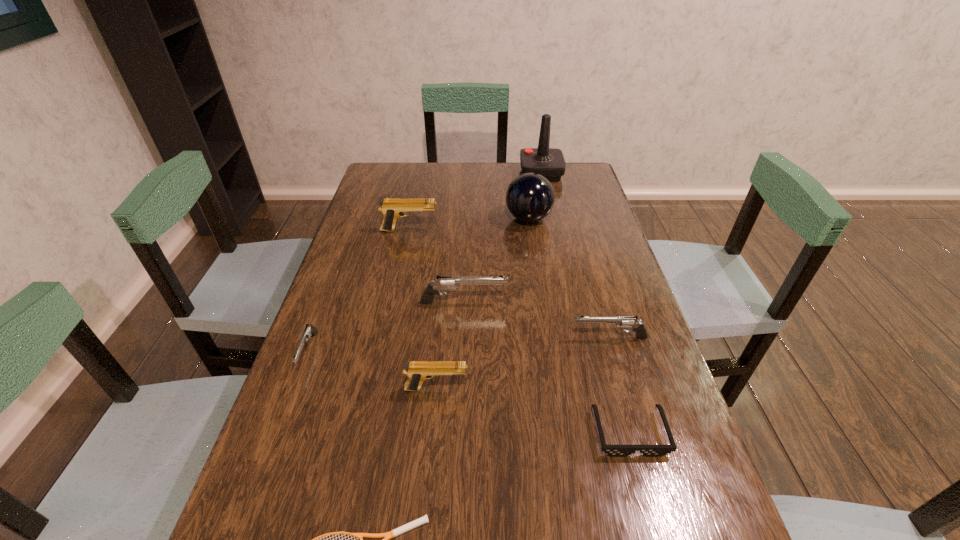
Find the location of a particular element. free space between the nearest pistol and the second nearest object is located at coordinates (533, 410).

Where is `free spot between the second shortest object and the joystick`? The height and width of the screenshot is (540, 960). free spot between the second shortest object and the joystick is located at coordinates (586, 303).

You are a GUI agent. You are given a task and a screenshot of the screen. Output one action in this format:
    pyautogui.click(x=<x>, y=<y>)
    Task: Click on the empty space that is in between the bowling ball and the biggest silver pistol
    
    Given the screenshot: What is the action you would take?
    pyautogui.click(x=496, y=260)

I want to click on blank region between the tallest pistol and the bowling ball, so click(x=468, y=225).

Point out which object is positioned as the nearest to the fourth tallest pistol. Please provide its 2D coordinates. Your answer should be formatted as a tuple, i.e. [(x, y)], where the tuple contains the x and y coordinates of a point satisfying the conditions above.

[(443, 283)]

Locate which object is the sixth closest to the nearest object. Please provide its 2D coordinates. Your answer should be formatted as a tuple, i.e. [(x, y)], where the tuple contains the x and y coordinates of a point satisfying the conditions above.

[(392, 208)]

The height and width of the screenshot is (540, 960). I want to click on the third closest pistol to the rightmost pistol, so click(x=392, y=208).

At what (x,y) coordinates should I click in order to perform the action: click on pistol that is the nearest to the farthest pistol. Please return your answer as a coordinate pair (x, y). Looking at the image, I should click on (443, 283).

You are a GUI agent. You are given a task and a screenshot of the screen. Output one action in this format:
    pyautogui.click(x=<x>, y=<y>)
    Task: Click on the second closest silver pistol to the nearer tan pistol
    This screenshot has width=960, height=540.
    Given the screenshot: What is the action you would take?
    pyautogui.click(x=443, y=283)

Locate which silver pistol ranks second in proximity to the shortest object. Please provide its 2D coordinates. Your answer should be formatted as a tuple, i.e. [(x, y)], where the tuple contains the x and y coordinates of a point satisfying the conditions above.

[(623, 322)]